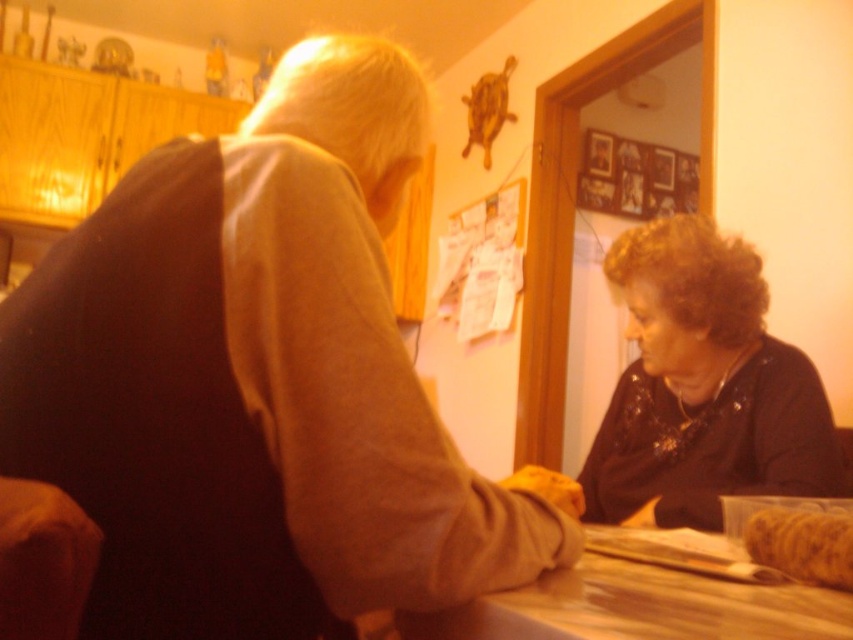
You are standing in the room and want to place a small object on the wooden at center without it touching the dark brown sweater at lower right. Is this possible?

The dark brown sweater at lower right is above the wooden at center, so placing the small object on the wooden at center would be underneath the sweater and not touching it.

You are standing in the room and see the brown matte sweater at upper left and the dark brown sweater at lower right. Which one is located higher up in the image?

The brown matte sweater at upper left is located higher up in the image than the dark brown sweater at lower right.

You are organizing a charity event and need to display two sweaters on a mannequin. The brown matte sweater at upper left and the dark brown sweater at lower right. Which sweater should you choose if you want the one that is bigger in size?

The brown matte sweater at upper left has a larger size compared to the dark brown sweater at lower right, so you should choose the brown matte sweater at upper left.